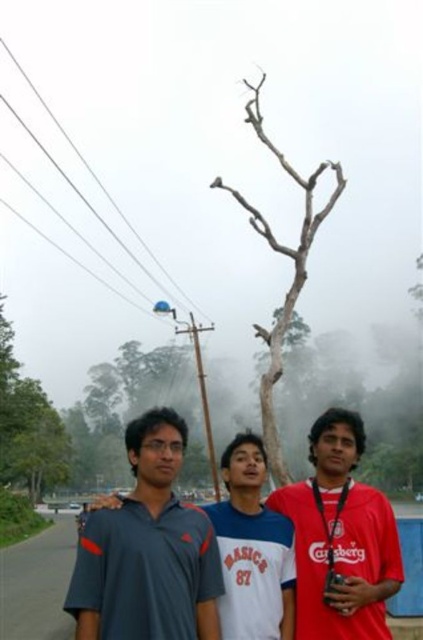
You are a photographer trying to capture a group photo of the two people in the center wearing the red matte shirt at center and white cotton shirt at center. Since you want to ensure their positions are clear in the photo, which one should be on the left side of the frame?

The white cotton shirt at center should be positioned on the left side of the frame because the red matte shirt at center is to the right of it.

You are a photographer trying to capture a closeup of the red matte shirt at center. Where should you position your camera to ensure the subject is in focus?

Position the camera directly facing the red matte shirt at center at point (340, 538) to ensure it is in focus.